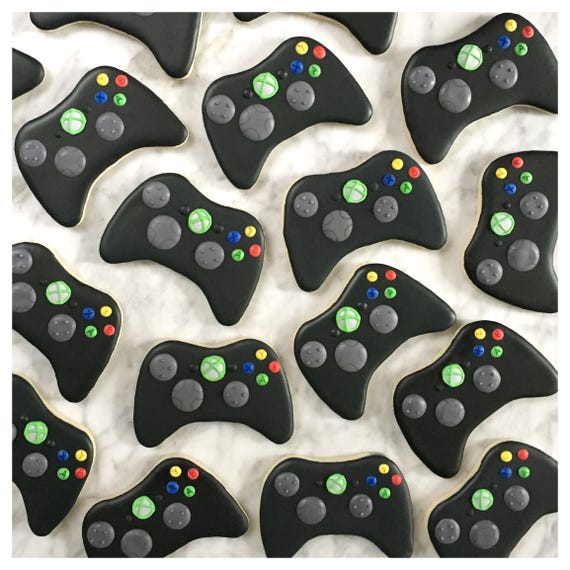
At what (x,y) coordinates should I click in order to perform the action: click on table. Please return your answer as a coordinate pair (x, y). The height and width of the screenshot is (570, 570). Looking at the image, I should click on (283, 303).